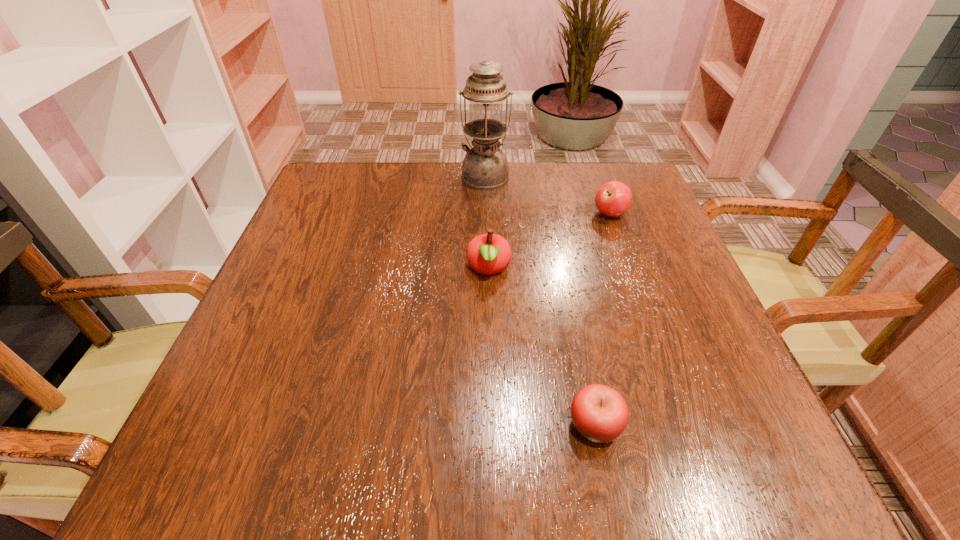
Locate an element on the screen. Image resolution: width=960 pixels, height=540 pixels. vacant region that satisfies the following two spatial constraints: 1. on the front side of the nearest object; 2. on the left side of the tallest object is located at coordinates (489, 425).

At what (x,y) coordinates should I click in order to perform the action: click on free space that satisfies the following two spatial constraints: 1. on the front side of the farthest object; 2. on the left side of the third farthest object. Please return your answer as a coordinate pair (x, y). Looking at the image, I should click on (487, 268).